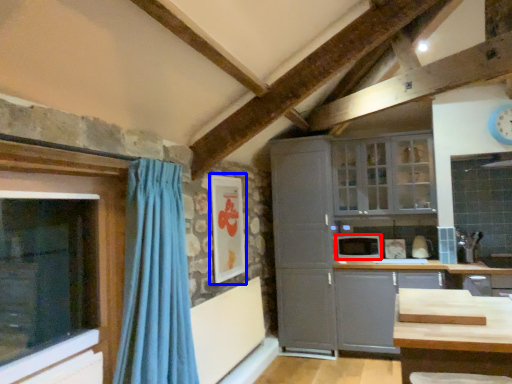
Question: Which object is closer to the camera taking this photo, appliance (highlighted by a red box) or picture frame (highlighted by a blue box)?

Choices:
 (A) appliance
 (B) picture frame

Answer: (B)